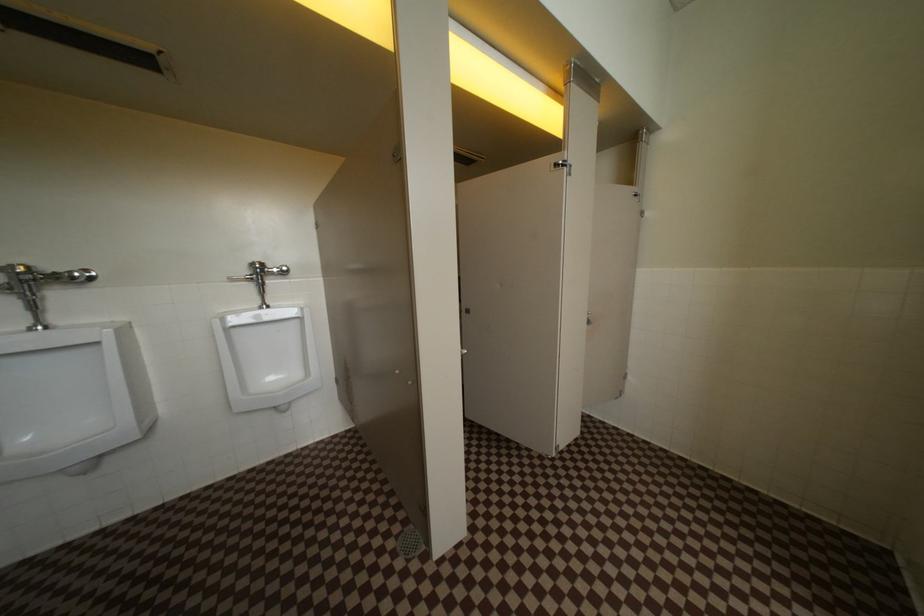
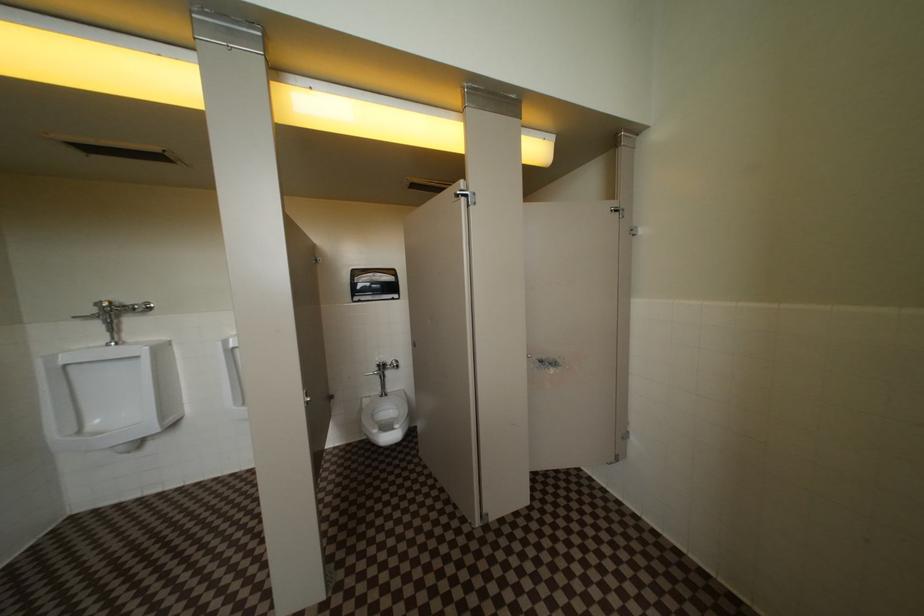
Question: The camera is either moving clockwise (left) or counter-clockwise (right) around the object. The first image is from the beginning of the video and the second image is from the end. Is the camera moving left or right when shooting the video?

Choices:
 (A) Left
 (B) Right

Answer: (B)